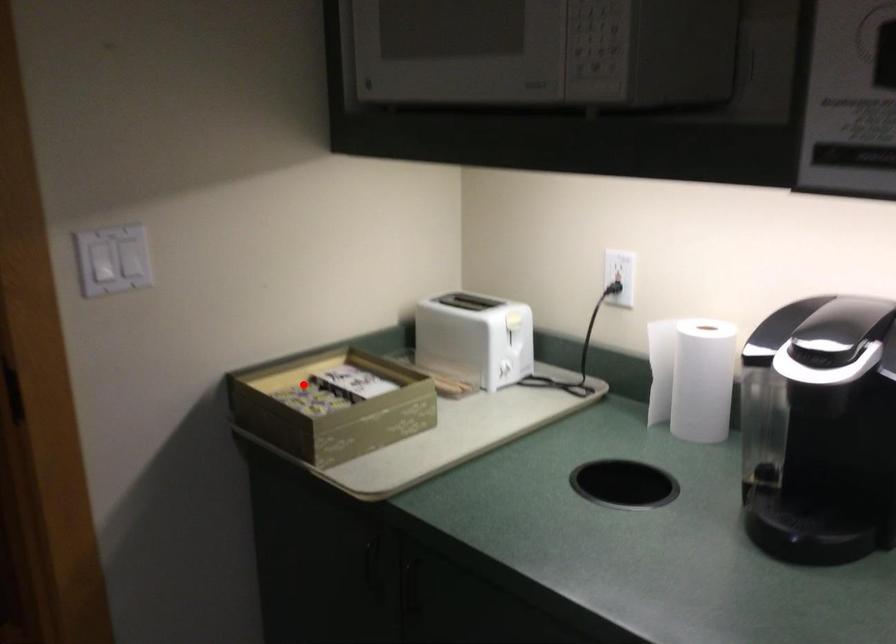
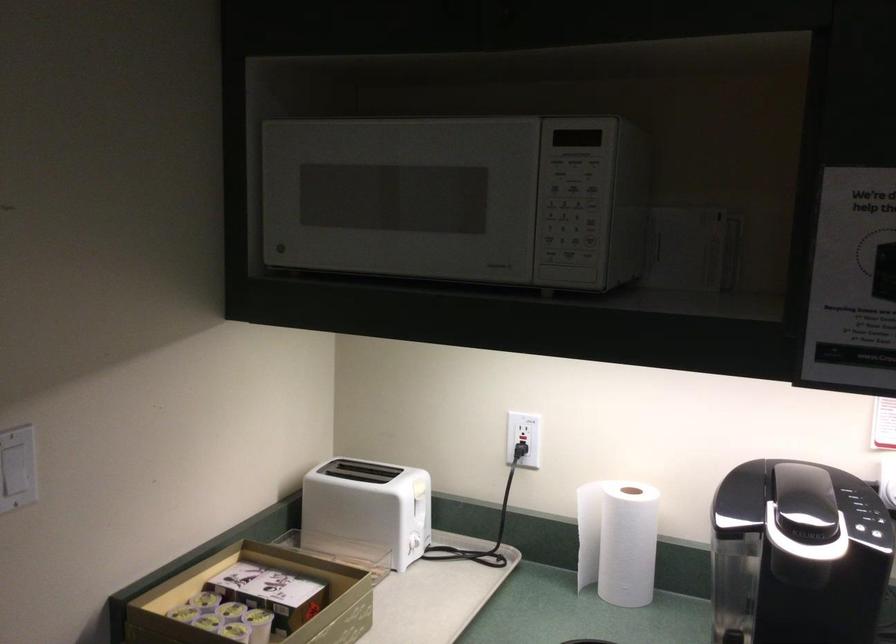
Question: I am providing you with two images of the same scene from different viewpoints. Given a red point in image1, look at the same physical point in image2. Is it:

Choices:
 (A) Closer to the viewpoint
 (B) Farther from the viewpoint

Answer: (A)